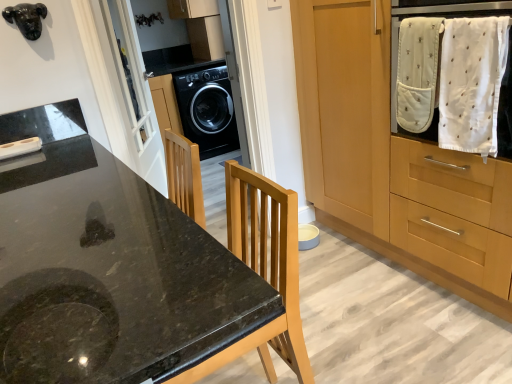
Question: Which is correct: white glass screen door at upper left is inside white soft cloth at upper right, or outside of it?

Choices:
 (A) inside
 (B) outside

Answer: (B)

Question: Is white glass screen door at upper left wider or thinner than white soft cloth at upper right?

Choices:
 (A) thin
 (B) wide

Answer: (B)

Question: Estimate the real-world distances between objects in this image. Which object is farther from the white cotton towel at upper right?

Choices:
 (A) black granite countertop at center
 (B) white soft cloth at upper right
 (C) black glossy washing machine at center
 (D) white glass screen door at upper left
 (E) wooden cabinet at right

Answer: (C)

Question: Which is nearer to the white glass screen door at upper left?

Choices:
 (A) black granite countertop at center
 (B) wooden cabinet at right
 (C) white cotton towel at upper right
 (D) white soft cloth at upper right
 (E) black glossy washing machine at center

Answer: (B)